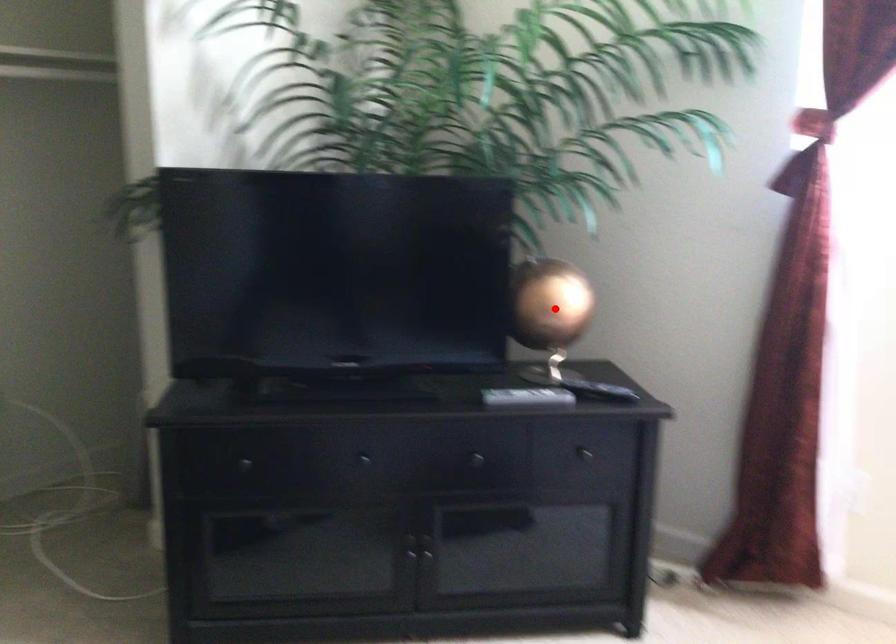
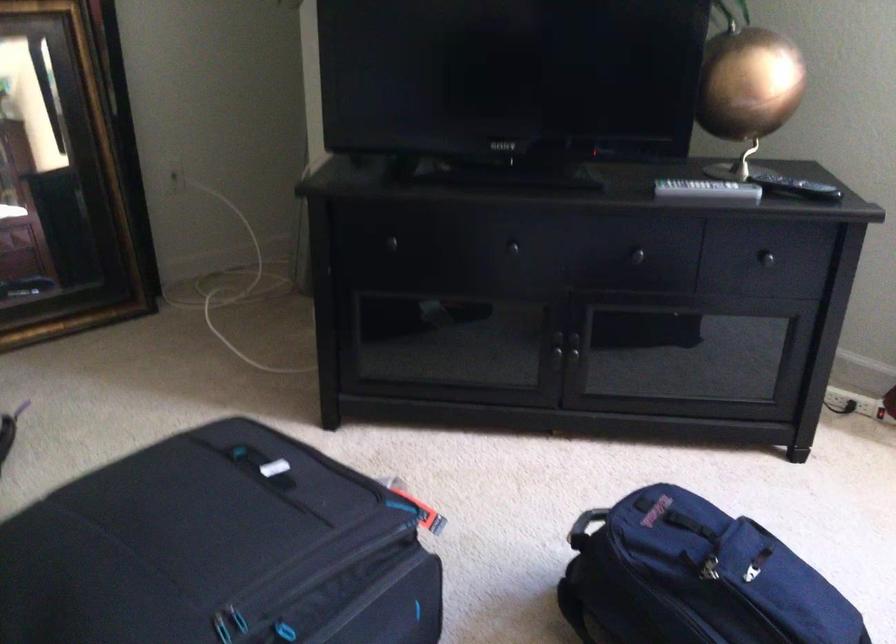
Question: I am providing you with two images of the same scene from different viewpoints. In image1, a red point is highlighted. Considering the same 3D point in image2, which of the following is correct?

Choices:
 (A) It is closer
 (B) It is farther

Answer: (A)